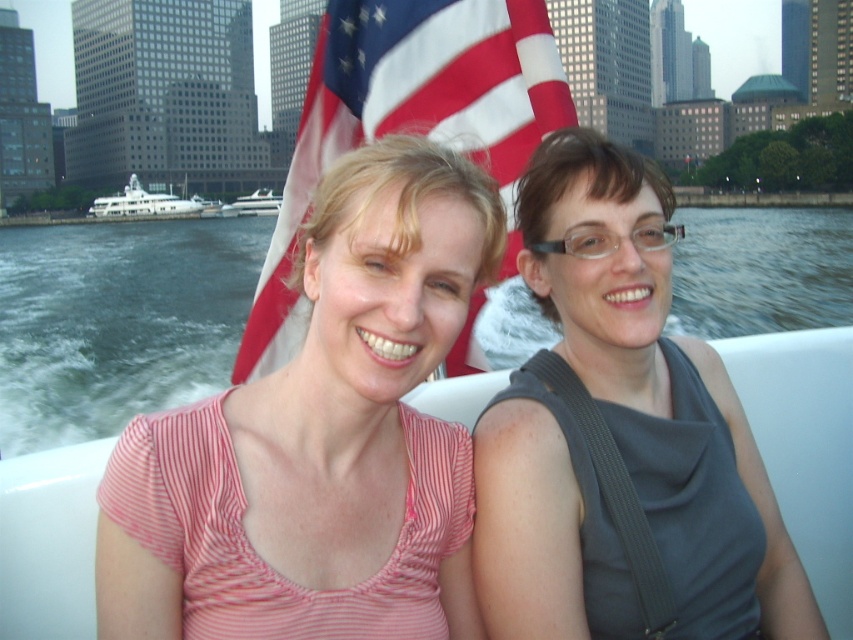
You are on a boat and want to know the position of the white glossy yacht at left relative to the white glossy yacht at center. Which one is positioned to the left?

The white glossy yacht at left is positioned to the left of the white glossy yacht at center.

You are standing on the deck of the boat and want to know which of the two points, point [352,129] or point [260,204], is nearer to you. Which one is closer?

Point [352,129] is closer to the camera than point [260,204], so it is the closer one.

You are a photographer trying to capture a clear shot of both the american flag at center and the white glossy yacht at center. Based on their positions, which object should you focus on first to ensure it appears in the foreground of your photo?

The american flag at center is below the white glossy yacht at center, so you should focus on the white glossy yacht at center first to ensure it appears in the foreground.